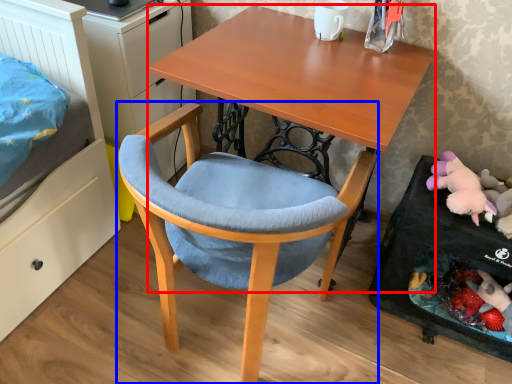
Question: Among these objects, which one is nearest to the camera, desk (highlighted by a red box) or chair (highlighted by a blue box)?

Choices:
 (A) desk
 (B) chair

Answer: (B)